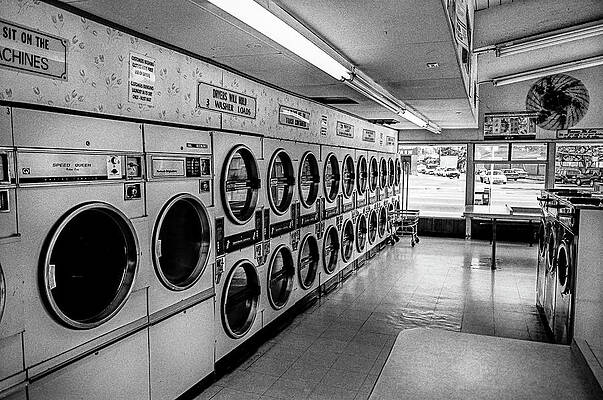
Identify the location of floor. Image resolution: width=603 pixels, height=400 pixels. (302, 390), (323, 352), (348, 326), (368, 305), (388, 281), (411, 261), (428, 252).